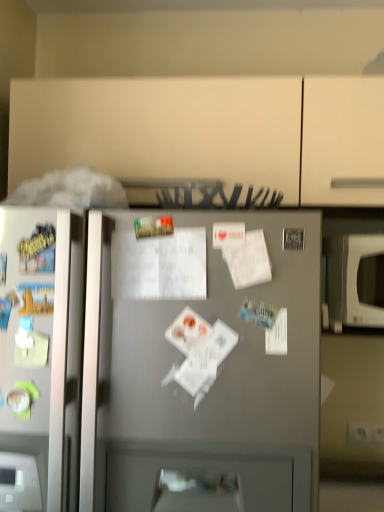
Question: Can you confirm if white matte paper at center is smaller than white glossy microwave at right?

Choices:
 (A) yes
 (B) no

Answer: (A)

Question: From the image's perspective, is white matte paper at center over white glossy microwave at right?

Choices:
 (A) no
 (B) yes

Answer: (B)

Question: Can you confirm if white matte paper at center is bigger than white glossy microwave at right?

Choices:
 (A) no
 (B) yes

Answer: (A)

Question: From a real-world perspective, is white matte paper at center on top of white glossy microwave at right?

Choices:
 (A) no
 (B) yes

Answer: (B)

Question: Does white matte paper at center appear on the right side of white glossy microwave at right?

Choices:
 (A) yes
 (B) no

Answer: (B)

Question: From a real-world perspective, is white matte paper at center below white glossy microwave at right?

Choices:
 (A) yes
 (B) no

Answer: (B)

Question: Considering the relative positions of white glossy microwave at right and satin silver refrigerator at center in the image provided, is white glossy microwave at right to the right of satin silver refrigerator at center from the viewer's perspective?

Choices:
 (A) no
 (B) yes

Answer: (B)

Question: Considering the relative sizes of white glossy microwave at right and satin silver refrigerator at center in the image provided, is white glossy microwave at right thinner than satin silver refrigerator at center?

Choices:
 (A) no
 (B) yes

Answer: (B)

Question: Does white glossy microwave at right have a greater height compared to satin silver refrigerator at center?

Choices:
 (A) yes
 (B) no

Answer: (B)

Question: Does white glossy microwave at right have a larger size compared to satin silver refrigerator at center?

Choices:
 (A) yes
 (B) no

Answer: (B)

Question: From the image's perspective, is white glossy microwave at right over satin silver refrigerator at center?

Choices:
 (A) yes
 (B) no

Answer: (A)

Question: Is white glossy microwave at right closer to the viewer compared to satin silver refrigerator at center?

Choices:
 (A) no
 (B) yes

Answer: (A)

Question: Does white glossy microwave at right turn towards white matte paper at center?

Choices:
 (A) yes
 (B) no

Answer: (B)